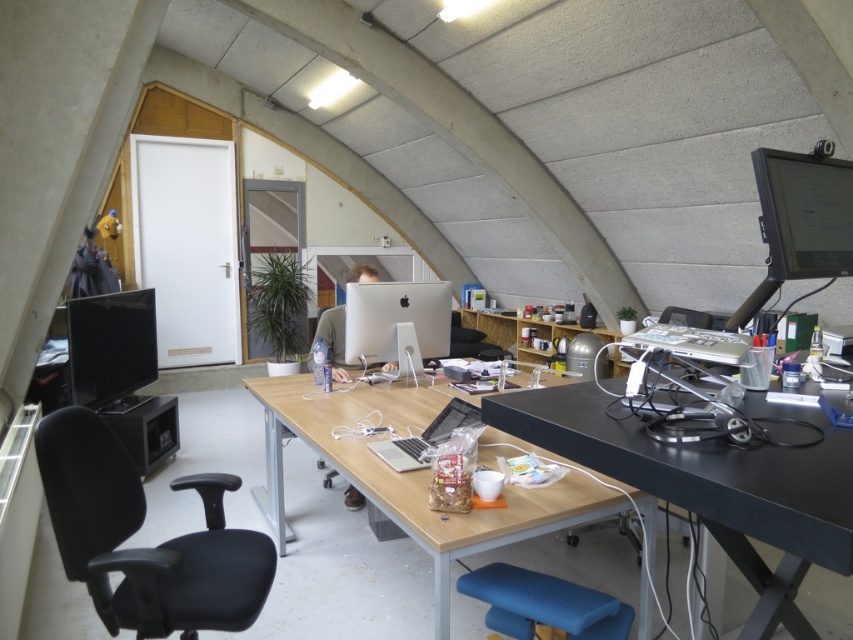
Question: Which is nearer to the matte black monitor at upper right?

Choices:
 (A) black fabric swivel chair at left
 (B) black matte table at right
 (C) blue fabric stool at lower center
 (D) satin black laptop at center

Answer: (B)

Question: Does black matte table at right appear on the right side of blue fabric stool at lower center?

Choices:
 (A) no
 (B) yes

Answer: (B)

Question: Is blue fabric stool at lower center below satin black laptop at center?

Choices:
 (A) no
 (B) yes

Answer: (B)

Question: Does matte black monitor at left appear on the left side of satin silver monitor at center?

Choices:
 (A) no
 (B) yes

Answer: (B)

Question: Based on their relative distances, which object is farther from the matte black monitor at upper right?

Choices:
 (A) blue fabric stool at lower center
 (B) satin black laptop at center
 (C) matte black monitor at left

Answer: (C)

Question: Which is nearer to the blue fabric stool at lower center?

Choices:
 (A) matte black monitor at left
 (B) black matte table at right

Answer: (B)